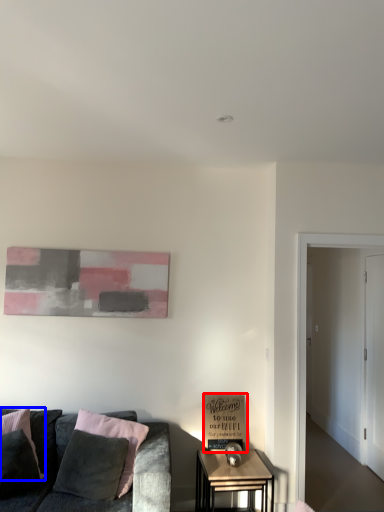
Question: Which point is closer to the camera, cardboard box (highlighted by a red box) or pillow (highlighted by a blue box)?

Choices:
 (A) cardboard box
 (B) pillow

Answer: (B)